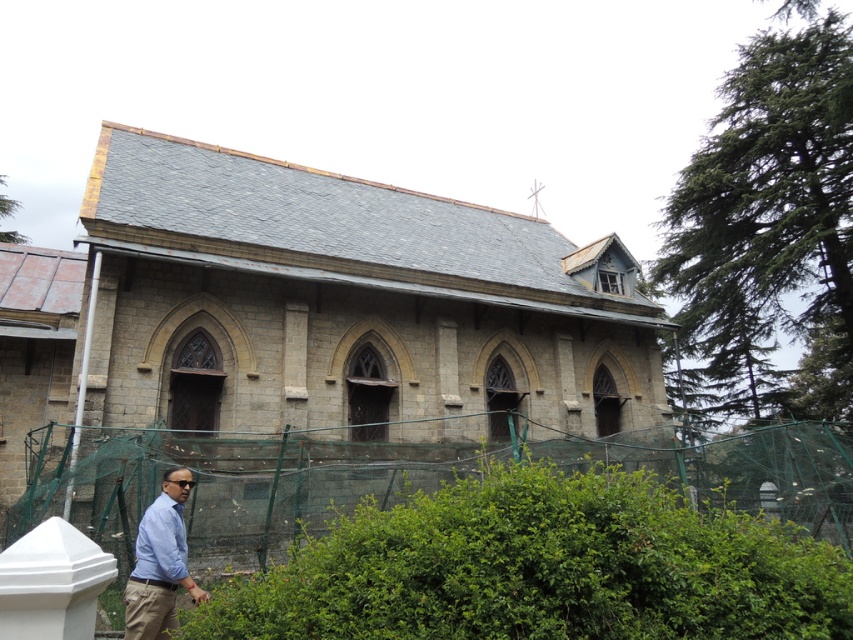
Question: Is light blue shirt at lower left below light blue cotton shirt at lower left?

Choices:
 (A) no
 (B) yes

Answer: (B)

Question: Which object appears closest to the camera in this image?

Choices:
 (A) light blue shirt at lower left
 (B) green leafy hedge at lower left
 (C) light blue cotton shirt at lower left

Answer: (B)

Question: Which of the following is the closest to the observer?

Choices:
 (A) green leafy hedge at lower left
 (B) light blue cotton shirt at lower left

Answer: (A)

Question: Is green leafy hedge at lower left further to camera compared to light blue cotton shirt at lower left?

Choices:
 (A) no
 (B) yes

Answer: (A)

Question: Is green leafy hedge at lower left to the right of light blue shirt at lower left from the viewer's perspective?

Choices:
 (A) no
 (B) yes

Answer: (B)

Question: Which is farther from the light blue cotton shirt at lower left?

Choices:
 (A) light blue shirt at lower left
 (B) green leafy hedge at lower left

Answer: (B)